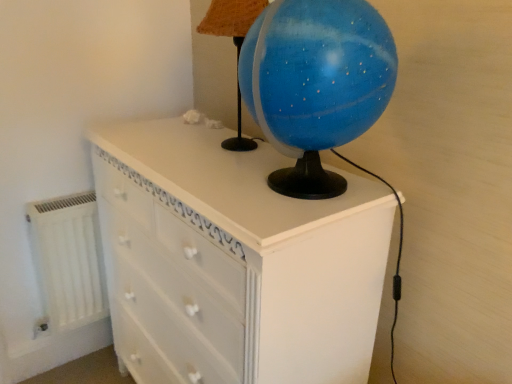
Where is `free spot below blue glossy globe at upper center (from a real-world perspective)`? Image resolution: width=512 pixels, height=384 pixels. free spot below blue glossy globe at upper center (from a real-world perspective) is located at coordinates (239, 140).